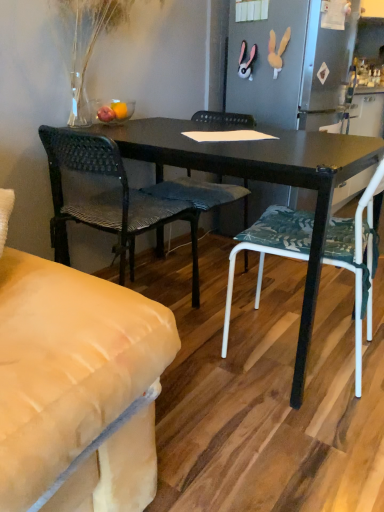
Question: Is woven fabric chair at center, which is the 1th chair from left to right, inside the boundaries of white fabric chair at center, arranged as the 1th chair when viewed from the right, or outside?

Choices:
 (A) inside
 (B) outside

Answer: (B)

Question: Is woven fabric chair at center, which is the 1th chair from left to right, wider or thinner than white fabric chair at center, arranged as the 3th chair when viewed from the left?

Choices:
 (A) thin
 (B) wide

Answer: (A)

Question: Estimate the real-world distances between objects in this image. Which object is farther from the woven fabric chair at center, the third chair in the right-to-left sequence?

Choices:
 (A) woven fabric chair at center, arranged as the 2th chair when viewed from the right
 (B) white fabric chair at center, arranged as the 3th chair when viewed from the left

Answer: (B)

Question: Which of these objects is positioned farthest from the woven fabric chair at center, which is the 1th chair from left to right?

Choices:
 (A) woven fabric chair at center, arranged as the 2th chair when viewed from the right
 (B) white fabric chair at center, arranged as the 3th chair when viewed from the left

Answer: (B)